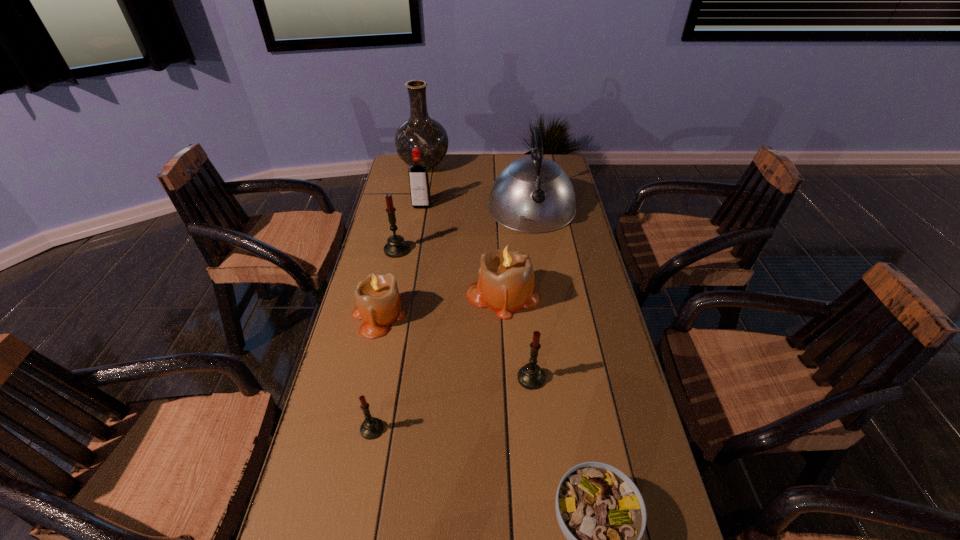
At what (x,y) coordinates should I click in order to perform the action: click on free region that satisfies the following two spatial constraints: 1. on the front side of the second biggest red candle; 2. on the left side of the biggest red candle. Please return your answer as a coordinate pair (x, y). Looking at the image, I should click on (370, 378).

The height and width of the screenshot is (540, 960). In order to click on vacant space that satisfies the following two spatial constraints: 1. on the back side of the vase; 2. on the left side of the shortest candle in this screenshot , I will do `click(422, 166)`.